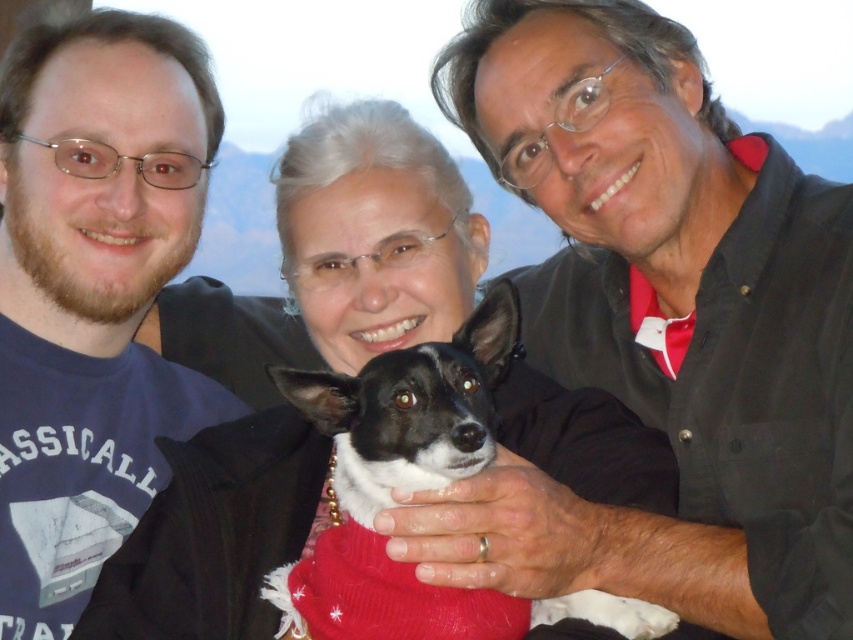
Question: Is the position of black matte shirt at center less distant than that of matte blue shirt at left?

Choices:
 (A) yes
 (B) no

Answer: (A)

Question: Which point appears closest to the camera in this image?

Choices:
 (A) (637, 188)
 (B) (71, 56)
 (C) (422, 356)

Answer: (C)

Question: Is black matte shirt at center behind black and white fur at center?

Choices:
 (A) no
 (B) yes

Answer: (B)

Question: Based on their relative distances, which object is farther from the black matte shirt at center?

Choices:
 (A) matte blue shirt at left
 (B) black and white fur at center

Answer: (A)

Question: Which object is the farthest from the black and white fur at center?

Choices:
 (A) black matte shirt at center
 (B) matte blue shirt at left

Answer: (B)

Question: Is black matte shirt at center to the left of matte blue shirt at left from the viewer's perspective?

Choices:
 (A) yes
 (B) no

Answer: (B)